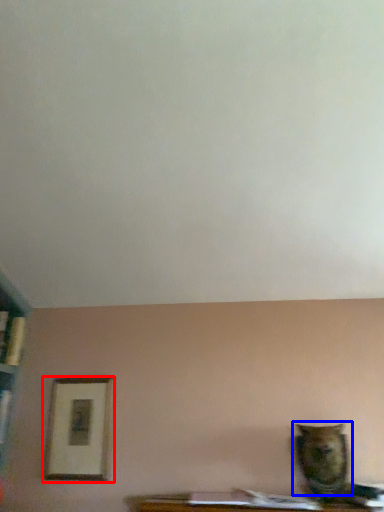
Question: Among these objects, which one is nearest to the camera, picture frame (highlighted by a red box) or animal (highlighted by a blue box)?

Choices:
 (A) picture frame
 (B) animal

Answer: (B)